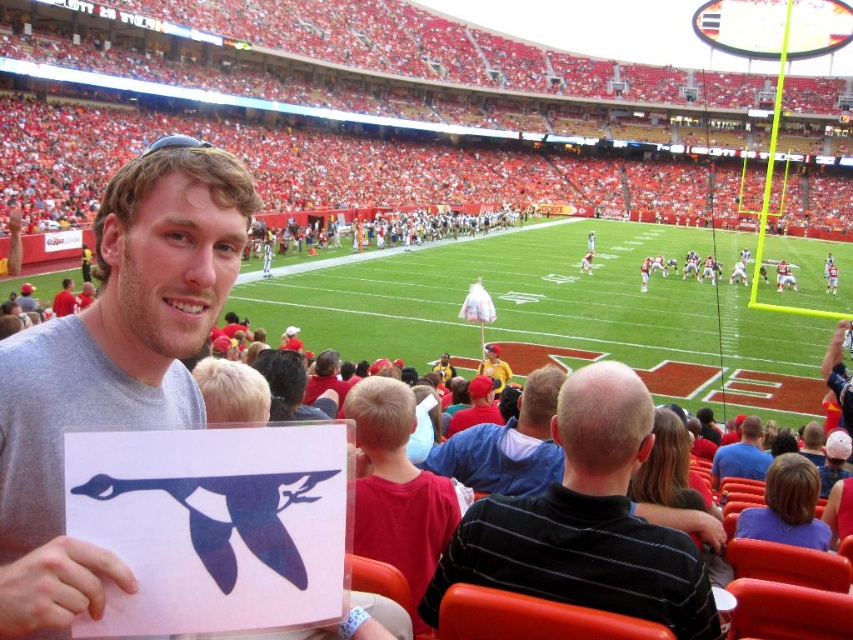
You are standing at the point labeled point (65,305) in the stadium. You want to walk towards the point labeled point (636,429). Will you pass through any obstacles along the way?

The point (636,429) is in front of point (65,305), so you will not pass through any obstacles along the way.

Consider the image. You are a photographer at the football stadium. You need to capture a photo of both the black striped shirt at center and the red shirt at center. Which shirt should you zoom in on to ensure both fit in the frame?

You should zoom in on the red shirt at center because the black striped shirt at center is wider than the red shirt at center, so focusing on the smaller one allows both to fit in the frame.

You are a photographer at the football stadium and want to take a picture of the black striped shirt at center. Where should you point your camera to capture it?

You should point your camera to the coordinates point at point (585, 522) to capture the black striped shirt at center.